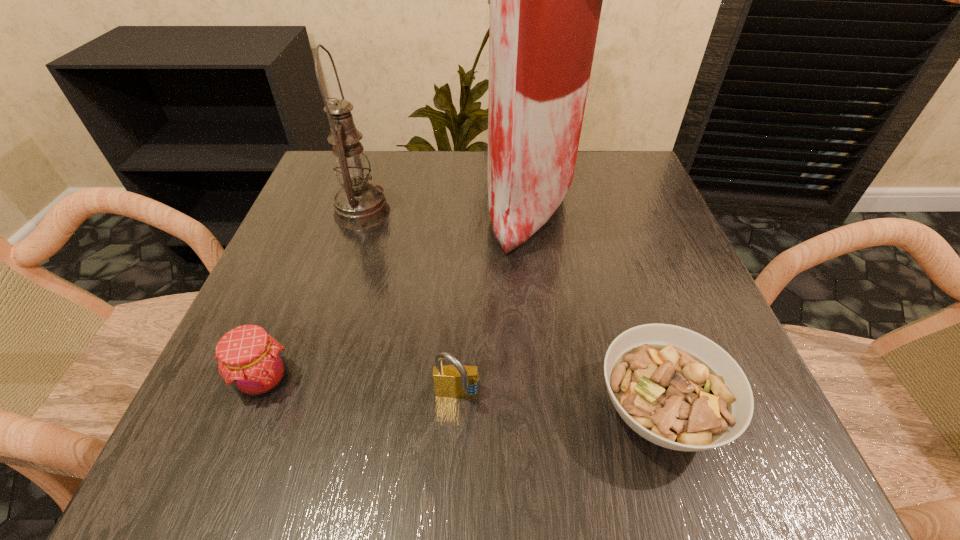
This screenshot has height=540, width=960. In order to click on free space between the jam and the oil lamp in this screenshot , I will do `click(313, 296)`.

This screenshot has width=960, height=540. In order to click on free space between the padlock and the second tallest object in this screenshot , I will do `click(410, 305)`.

The image size is (960, 540). In order to click on unoccupied area between the stew and the tallest object in this screenshot , I will do `click(594, 306)`.

Locate an element on the screen. The image size is (960, 540). free space between the stew and the oil lamp is located at coordinates click(x=511, y=312).

Locate an element on the screen. The height and width of the screenshot is (540, 960). vacant area between the oil lamp and the jam is located at coordinates (313, 296).

Image resolution: width=960 pixels, height=540 pixels. Identify the location of vacant point located between the jam and the third tallest object. (361, 389).

Locate an element on the screen. The image size is (960, 540). object that is the third closest one to the padlock is located at coordinates (545, 0).

Select which object is the third closest to the grocery bag. Please provide its 2D coordinates. Your answer should be formatted as a tuple, i.e. [(x, y)], where the tuple contains the x and y coordinates of a point satisfying the conditions above.

[(455, 381)]

You are a GUI agent. You are given a task and a screenshot of the screen. Output one action in this format:
    pyautogui.click(x=<x>, y=<y>)
    Task: Click on the free space that satisfies the following two spatial constraints: 1. on the front side of the jam; 2. on the left side of the stew
    The width and height of the screenshot is (960, 540).
    Given the screenshot: What is the action you would take?
    pyautogui.click(x=252, y=410)

The image size is (960, 540). Find the location of `free space that satisfies the following two spatial constraints: 1. on the front side of the stew; 2. on the right side of the oil lamp`. free space that satisfies the following two spatial constraints: 1. on the front side of the stew; 2. on the right side of the oil lamp is located at coordinates (300, 410).